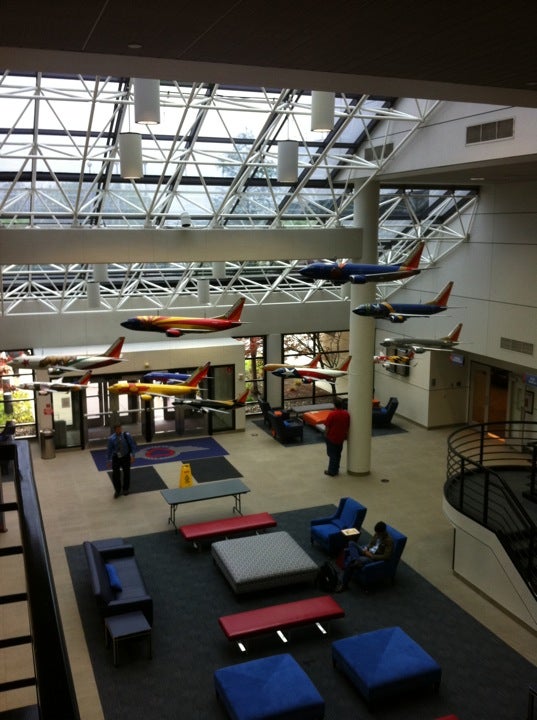
Where is `staircase`? staircase is located at coordinates (507, 482), (517, 541), (527, 595).